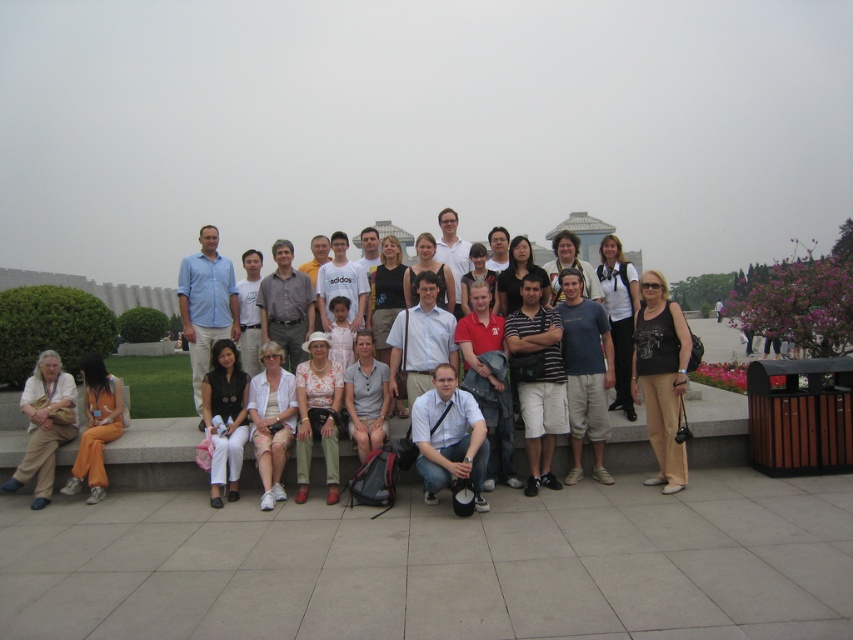
Does point (26, 454) come farther from viewer compared to point (86, 422)?

No, it is in front of (86, 422).

Does light beige pants at lower left appear over orange cotton pants at lower left?

Yes.

The width and height of the screenshot is (853, 640). Identify the location of light beige pants at lower left. (44, 424).